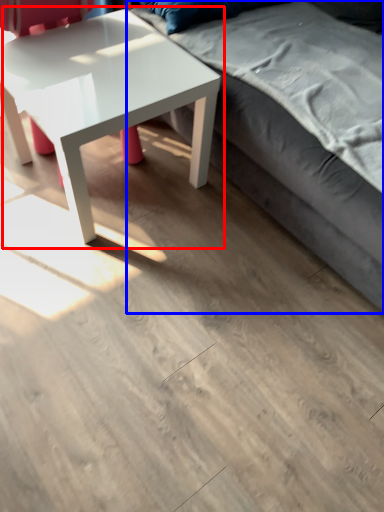
Question: Which of the following is the farthest to the observer, coffee table (highlighted by a red box) or studio couch (highlighted by a blue box)?

Choices:
 (A) coffee table
 (B) studio couch

Answer: (A)